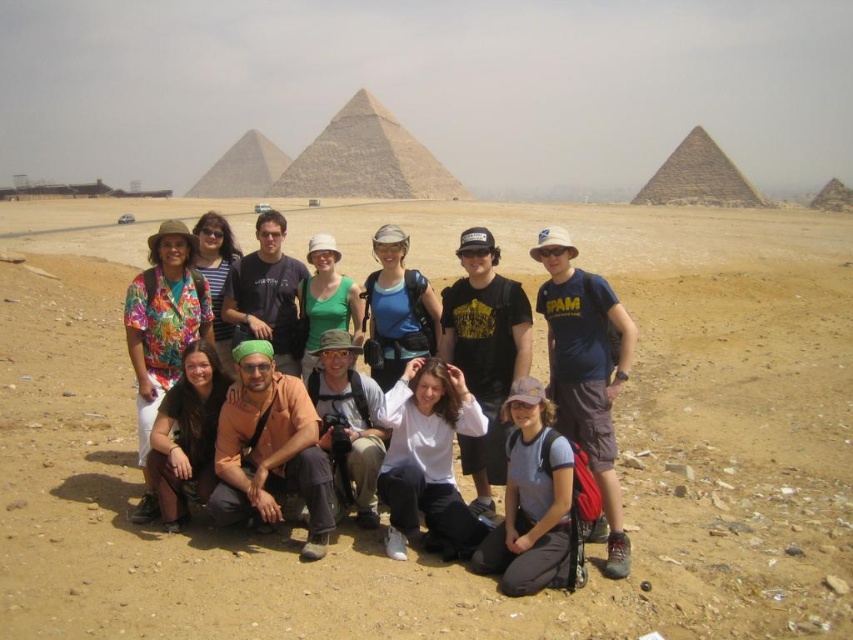
Question: Does green fabric shirt at center have a smaller size compared to smooth stone pyramid at center?

Choices:
 (A) yes
 (B) no

Answer: (A)

Question: Which of the following is the closest to the observer?

Choices:
 (A) (231, 371)
 (B) (844, 193)
 (C) (740, 173)
 (D) (305, 364)

Answer: (A)

Question: Is floral fabric shirt at left further to the viewer compared to smooth stone pyramid at center?

Choices:
 (A) yes
 (B) no

Answer: (B)

Question: Which point is farther to the camera?

Choices:
 (A) white matte shirt at center
 (B) brown fabric pants at lower left

Answer: (B)

Question: Based on their relative distances, which object is farther from the floral fabric shirt at center?

Choices:
 (A) smooth stone pyramid at upper right
 (B) blue cotton t-shirt at center
 (C) floral fabric shirt at left
 (D) khaki cotton shirt at center

Answer: (A)

Question: In this image, where is dark brown stone pyramid at right located relative to green fabric shirt at center?

Choices:
 (A) left
 (B) right

Answer: (B)